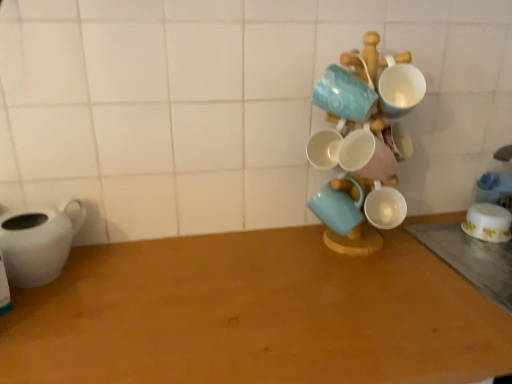
At what (x,y) coordinates should I click in order to perform the action: click on vacant space positioned to the left of matte ceramic mug at center, the second coffee cup when ordered from back to front. Please return your answer as a coordinate pair (x, y). Image resolution: width=512 pixels, height=384 pixels. Looking at the image, I should click on (262, 251).